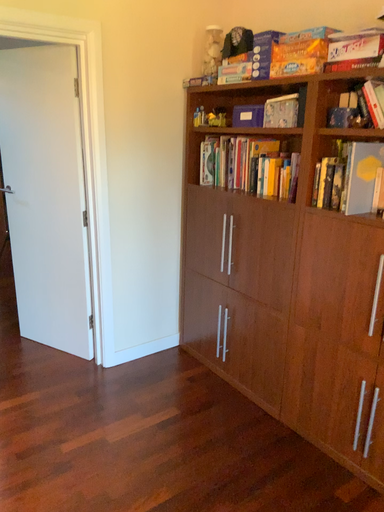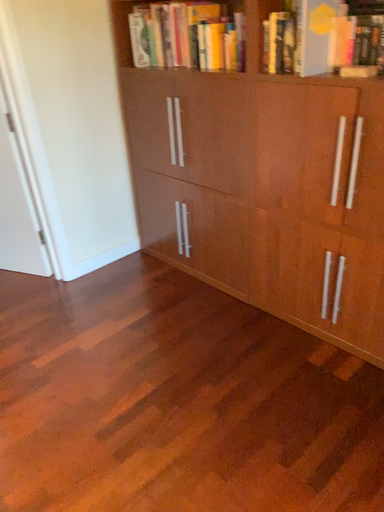
Question: Which way did the camera rotate in the video?

Choices:
 (A) rotated right
 (B) rotated left

Answer: (A)